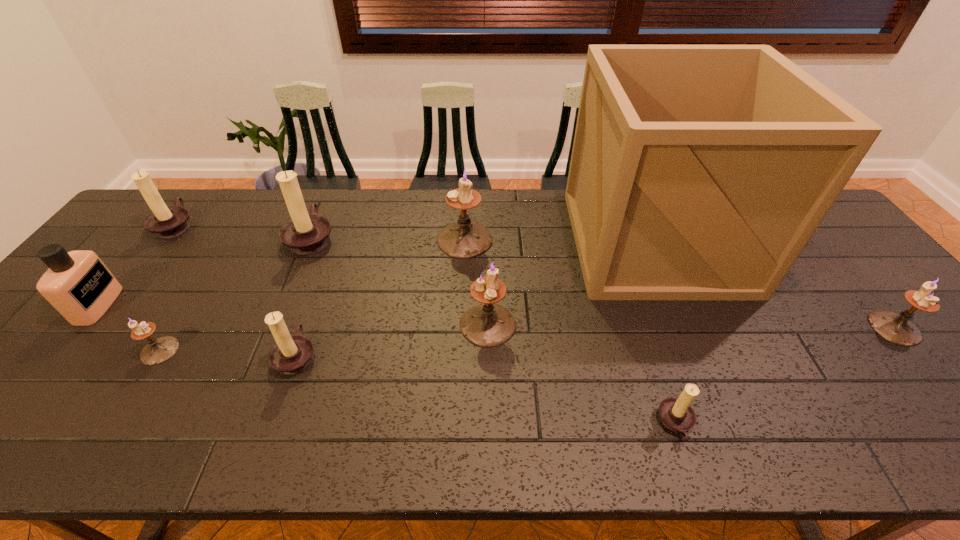
At what (x,y) coordinates should I click in order to perform the action: click on box. Please return your answer as a coordinate pair (x, y). The width and height of the screenshot is (960, 540). Looking at the image, I should click on (698, 172).

At what (x,y) coordinates should I click in order to perform the action: click on brown box. Please return your answer as a coordinate pair (x, y). The height and width of the screenshot is (540, 960). Looking at the image, I should click on (698, 172).

Find the location of `the biggest brown candle holder`. the biggest brown candle holder is located at coordinates (306, 233).

At what (x,y) coordinates should I click in order to perform the action: click on the farthest purple candle holder. Please return your answer as a coordinate pair (x, y). The image size is (960, 540). Looking at the image, I should click on (465, 239).

At what (x,y) coordinates should I click in order to perform the action: click on the third smallest brown candle holder. Please return your answer as a coordinate pair (x, y). The height and width of the screenshot is (540, 960). Looking at the image, I should click on (166, 222).

At what (x,y) coordinates should I click in order to perform the action: click on the leftmost brown candle holder. Please return your answer as a coordinate pair (x, y). This screenshot has width=960, height=540. Looking at the image, I should click on (166, 222).

At what (x,y) coordinates should I click in order to perform the action: click on the second biggest purple candle holder. Please return your answer as a coordinate pair (x, y). Looking at the image, I should click on (486, 325).

This screenshot has height=540, width=960. I want to click on beige perfume, so click(x=78, y=285).

Identify the location of the third farthest brown candle holder. coord(291,354).

Identify the location of the rightmost purple candle holder. (897, 328).